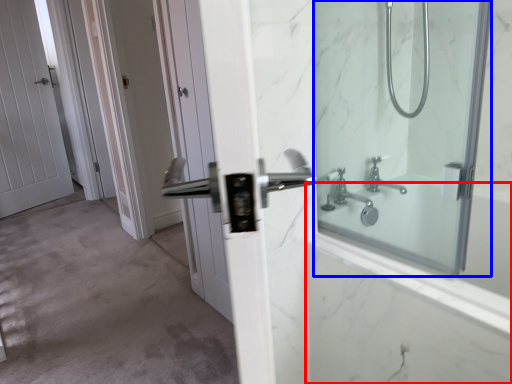
Question: Which of the following is the farthest to the observer, bath (highlighted by a red box) or mirror (highlighted by a blue box)?

Choices:
 (A) bath
 (B) mirror

Answer: (A)